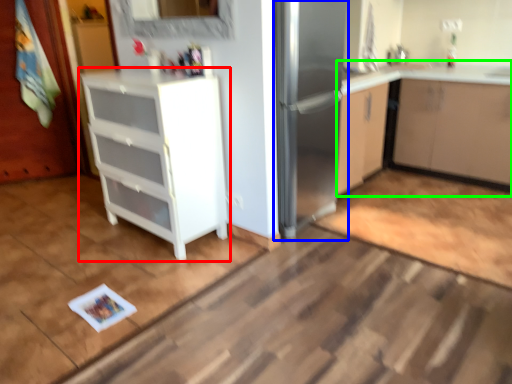
Question: Based on their relative distances, which object is farther from cabinetry (highlighted by a red box)? Choose from fridge (highlighted by a blue box) and cabinetry (highlighted by a green box).

Choices:
 (A) fridge
 (B) cabinetry

Answer: (B)